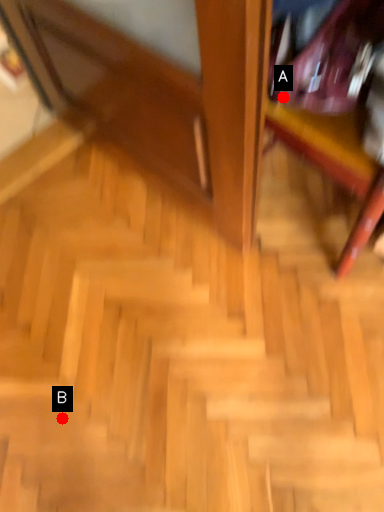
Question: Two points are circled on the image, labeled by A and B beside each circle. Which point is closer to the camera?

Choices:
 (A) A is closer
 (B) B is closer

Answer: (A)